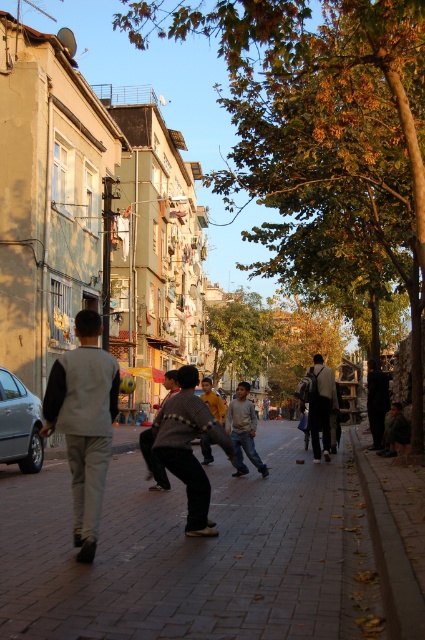
You are a delivery person who needs to avoid stepping on the brick pavement at center while delivering a package. Which direction should you walk to avoid it?

The brick pavement at center is located at coordinates point (178,554). To avoid it, you should walk in any direction away from that point, such as north, south, east, or west, depending on your current position relative to it.

You are a delivery person trying to navigate through the street. There is a brick pavement at center and a light gray vest at center in the way. Which one can you pass through more easily?

The brick pavement at center has a larger width than the light gray vest at center, so you can pass through the brick pavement at center more easily.